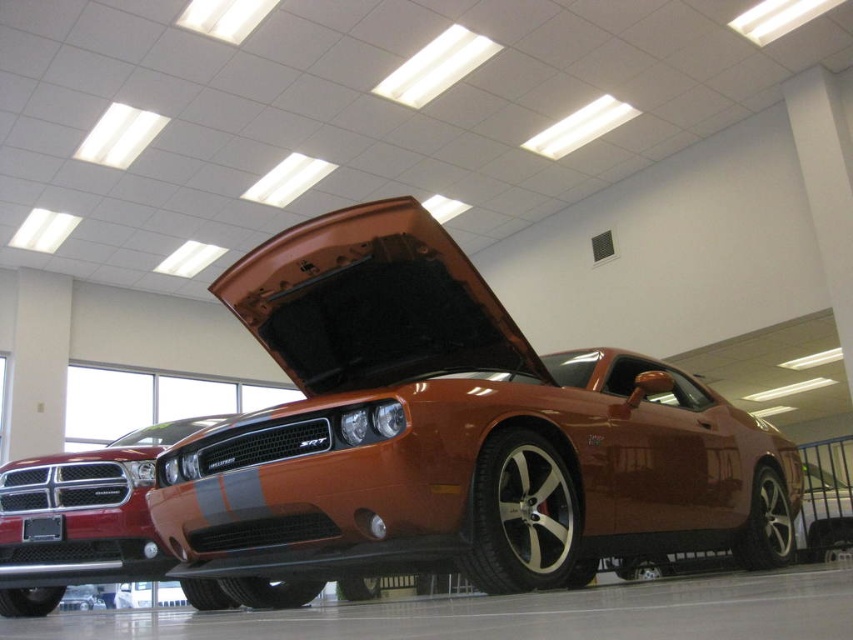
Which is more to the right, shiny orange muscle car at center or orange matte hood at center?

From the viewer's perspective, shiny orange muscle car at center appears more on the right side.

Is point (489, 445) positioned in front of point (331, 275)?

Yes, point (489, 445) is in front of point (331, 275).

Between point (672, 518) and point (380, 380), which one is positioned in front?

Point (672, 518) is in front.

Identify the location of shiny orange muscle car at center. (450, 435).

Is shiny orange muscle car at center wider than glossy metallic car at center?

Yes, shiny orange muscle car at center is wider than glossy metallic car at center.

Between shiny orange muscle car at center and glossy metallic car at center, which one is positioned lower?

glossy metallic car at center is below.

Does point (543, 582) come behind point (80, 515)?

No, (543, 582) is in front of (80, 515).

Where is `shiny orange muscle car at center`? This screenshot has width=853, height=640. shiny orange muscle car at center is located at coordinates (450, 435).

Is point (242, 257) behind point (117, 579)?

Yes, it is behind point (117, 579).

Can you confirm if orange matte hood at center is positioned below glossy metallic car at center?

Incorrect, orange matte hood at center is not positioned below glossy metallic car at center.

Locate an element on the screen. orange matte hood at center is located at coordinates (372, 301).